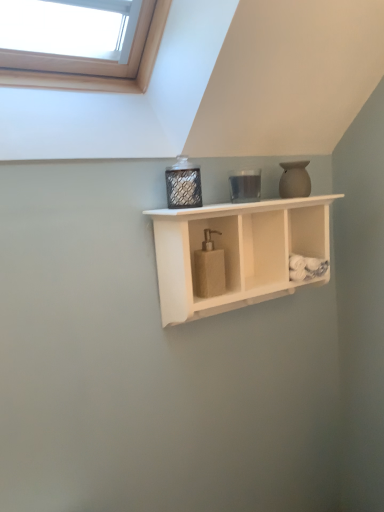
Question: Is metallic mesh container at center looking in the opposite direction of matte beige vase at upper right?

Choices:
 (A) no
 (B) yes

Answer: (A)

Question: Considering the relative sizes of metallic mesh container at center and matte beige vase at upper right in the image provided, is metallic mesh container at center wider than matte beige vase at upper right?

Choices:
 (A) yes
 (B) no

Answer: (A)

Question: Is metallic mesh container at center outside of matte beige vase at upper right?

Choices:
 (A) no
 (B) yes

Answer: (B)

Question: Does metallic mesh container at center have a greater height compared to matte beige vase at upper right?

Choices:
 (A) yes
 (B) no

Answer: (B)

Question: Can you confirm if metallic mesh container at center is thinner than matte beige vase at upper right?

Choices:
 (A) no
 (B) yes

Answer: (A)

Question: Is matte beige vase at upper right to the left or to the right of white matte wood shelf at center in the image?

Choices:
 (A) right
 (B) left

Answer: (A)

Question: In terms of height, does matte beige vase at upper right look taller or shorter compared to white matte wood shelf at center?

Choices:
 (A) short
 (B) tall

Answer: (A)

Question: From the image's perspective, is matte beige vase at upper right located above or below white matte wood shelf at center?

Choices:
 (A) above
 (B) below

Answer: (A)

Question: Considering the positions of matte beige vase at upper right and white matte wood shelf at center in the image, is matte beige vase at upper right bigger or smaller than white matte wood shelf at center?

Choices:
 (A) small
 (B) big

Answer: (A)

Question: Is matte beige vase at upper right to the left or to the right of metallic mesh container at center in the image?

Choices:
 (A) right
 (B) left

Answer: (A)

Question: From a real-world perspective, is matte beige vase at upper right above or below metallic mesh container at center?

Choices:
 (A) above
 (B) below

Answer: (B)

Question: Looking at the image, does matte beige vase at upper right seem bigger or smaller compared to metallic mesh container at center?

Choices:
 (A) small
 (B) big

Answer: (A)

Question: Is matte beige vase at upper right inside the boundaries of metallic mesh container at center, or outside?

Choices:
 (A) inside
 (B) outside

Answer: (B)

Question: From a real-world perspective, is white matte wood shelf at center above or below metallic mesh container at center?

Choices:
 (A) below
 (B) above

Answer: (A)

Question: Looking at their shapes, would you say white matte wood shelf at center is wider or thinner than metallic mesh container at center?

Choices:
 (A) wide
 (B) thin

Answer: (A)